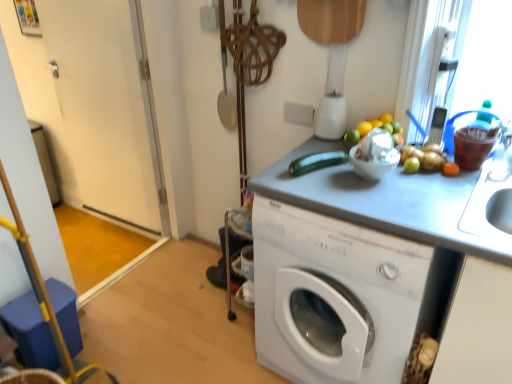
Question: Is the surface of white glossy door at left in direct contact with green matte zucchini at center?

Choices:
 (A) yes
 (B) no

Answer: (B)

Question: Is white glossy door at left at the left side of green matte zucchini at center?

Choices:
 (A) no
 (B) yes

Answer: (B)

Question: Is white glossy door at left outside green matte zucchini at center?

Choices:
 (A) no
 (B) yes

Answer: (B)

Question: From a real-world perspective, is white glossy door at left under green matte zucchini at center?

Choices:
 (A) yes
 (B) no

Answer: (A)

Question: Is white glossy door at left thinner than green matte zucchini at center?

Choices:
 (A) no
 (B) yes

Answer: (B)

Question: From the image's perspective, is white plastic blender at upper center located above or below white glossy door at left?

Choices:
 (A) above
 (B) below

Answer: (B)

Question: In the image, is white plastic blender at upper center positioned in front of or behind white glossy door at left?

Choices:
 (A) front
 (B) behind

Answer: (A)

Question: Is white plastic blender at upper center taller or shorter than white glossy door at left?

Choices:
 (A) tall
 (B) short

Answer: (B)

Question: Is white plastic blender at upper center wider or thinner than white glossy door at left?

Choices:
 (A) thin
 (B) wide

Answer: (B)

Question: Does point (79, 82) appear closer or farther from the camera than point (375, 339)?

Choices:
 (A) closer
 (B) farther

Answer: (B)

Question: Do you think white glossy door at left is within white glossy washing machine at center, or outside of it?

Choices:
 (A) outside
 (B) inside

Answer: (A)

Question: Considering the positions of white glossy door at left and white glossy washing machine at center in the image, is white glossy door at left taller or shorter than white glossy washing machine at center?

Choices:
 (A) tall
 (B) short

Answer: (A)

Question: In the image, is white glossy door at left positioned in front of or behind white glossy washing machine at center?

Choices:
 (A) behind
 (B) front

Answer: (A)

Question: Considering the positions of white plastic blender at upper center and white glossy washing machine at center in the image, is white plastic blender at upper center wider or thinner than white glossy washing machine at center?

Choices:
 (A) thin
 (B) wide

Answer: (A)

Question: Considering the positions of point pos(335,72) and point pos(283,370), is point pos(335,72) closer or farther from the camera than point pos(283,370)?

Choices:
 (A) farther
 (B) closer

Answer: (A)